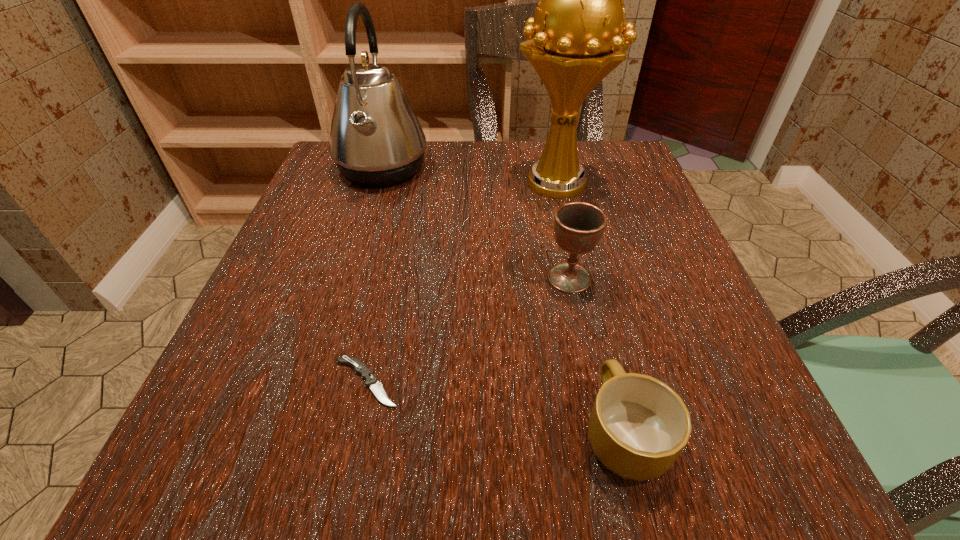
Where is `free space between the mug and the third nearest object`? The width and height of the screenshot is (960, 540). free space between the mug and the third nearest object is located at coordinates (596, 355).

Locate an element on the screen. vacant space that is in between the kettle and the tallest object is located at coordinates (469, 177).

Identify the location of free space between the shortest object and the trophy_cup. (462, 283).

Find the location of `empty space between the kettle and the trophy_cup`. empty space between the kettle and the trophy_cup is located at coordinates (469, 177).

Where is `vacant space that is in between the trophy_cup and the shortest object`? This screenshot has height=540, width=960. vacant space that is in between the trophy_cup and the shortest object is located at coordinates (462, 283).

At what (x,y) coordinates should I click in order to perform the action: click on free spot between the mug and the fourth shortest object. Please return your answer as a coordinate pair (x, y). This screenshot has width=960, height=540. Looking at the image, I should click on (503, 301).

Choose which object is the nearest neighbor to the chalice. Please provide its 2D coordinates. Your answer should be formatted as a tuple, i.e. [(x, y)], where the tuple contains the x and y coordinates of a point satisfying the conditions above.

[(573, 42)]

At what (x,y) coordinates should I click in order to perform the action: click on the second closest object to the third farthest object. Please return your answer as a coordinate pair (x, y). Looking at the image, I should click on (638, 426).

Where is `vacant space that satisfies the following two spatial constraints: 1. on the back side of the pocketknife; 2. from the spout of the kettle`? vacant space that satisfies the following two spatial constraints: 1. on the back side of the pocketknife; 2. from the spout of the kettle is located at coordinates (412, 170).

This screenshot has width=960, height=540. What are the coordinates of `vacant region that satisfies the following two spatial constraints: 1. from the spout of the second tallest object; 2. on the right side of the chalice` in the screenshot? It's located at (348, 278).